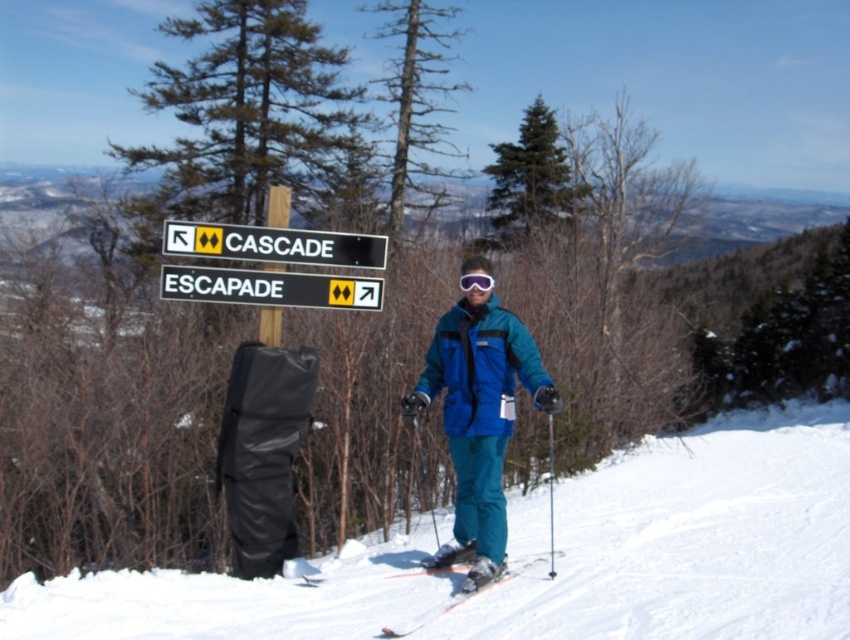
Question: Which point is farther from the camera taking this photo?

Choices:
 (A) (463, 484)
 (B) (363, 259)
 (C) (163, 278)
 (D) (506, 566)

Answer: (B)

Question: Is shiny metallic skis at center in front of purple matte goggles at center?

Choices:
 (A) yes
 (B) no

Answer: (A)

Question: Which object appears closest to the camera in this image?

Choices:
 (A) black plastic sign at upper center
 (B) green evergreen tree at upper center
 (C) white plastic sign at center
 (D) purple matte goggles at center

Answer: (D)

Question: Which point is farther from the camera taking this photo?

Choices:
 (A) (463, 545)
 (B) (363, 244)
 (C) (307, 307)
 (D) (476, 563)

Answer: (B)

Question: Does blue fabric ski slope at center have a larger size compared to green evergreen tree at upper center?

Choices:
 (A) yes
 (B) no

Answer: (B)

Question: Does shiny metallic skis at center have a larger size compared to purple matte goggles at center?

Choices:
 (A) no
 (B) yes

Answer: (B)